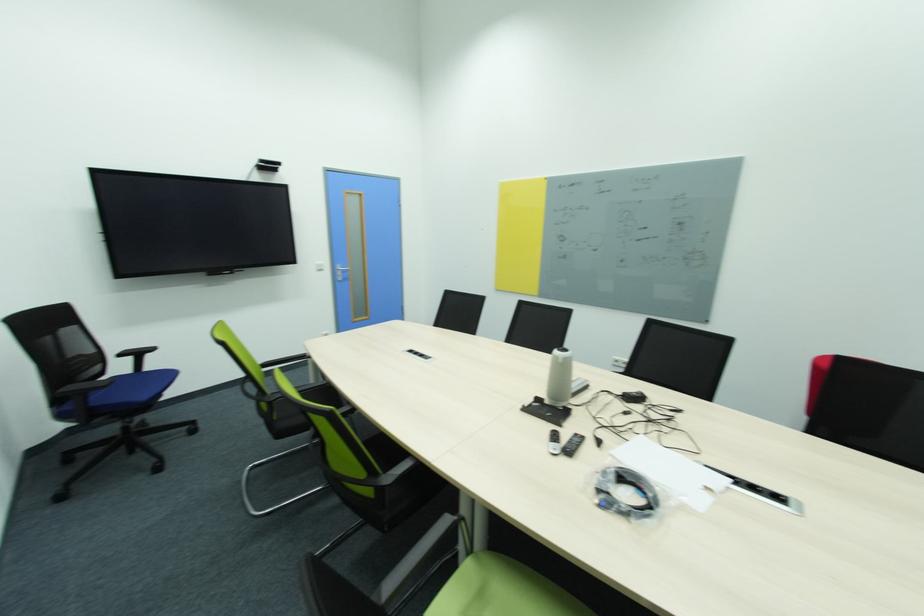
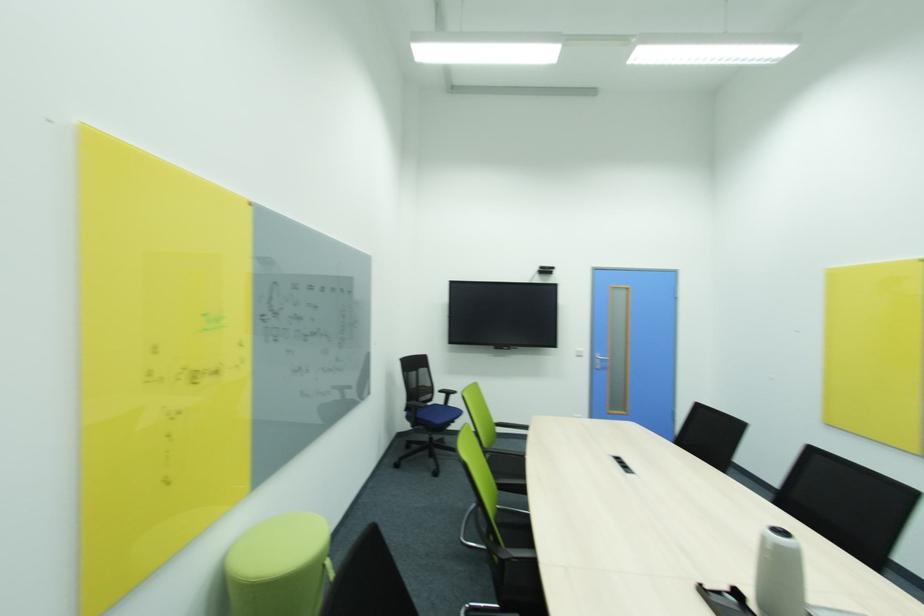
In the second image, find the point that corresponds to (344,280) in the first image.

(602, 368)